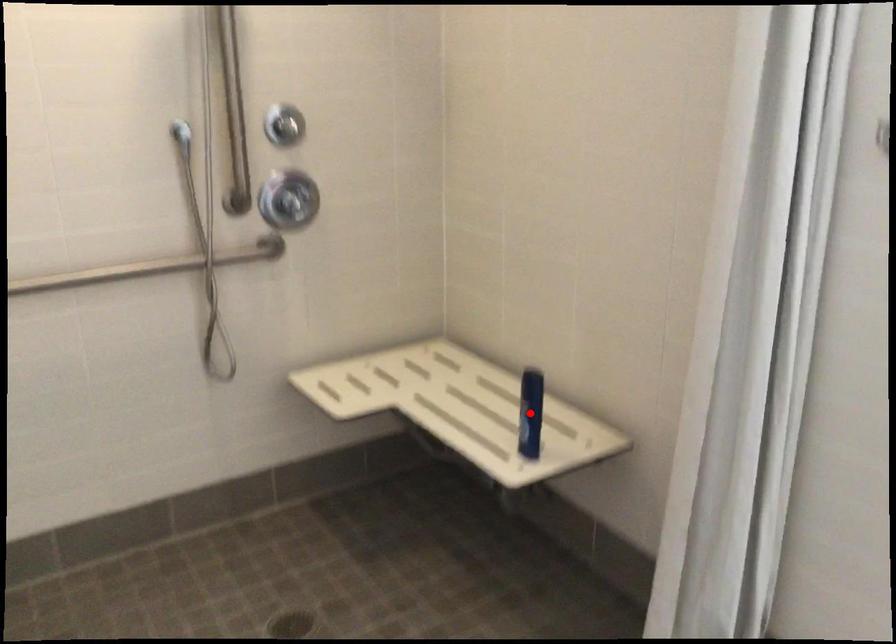
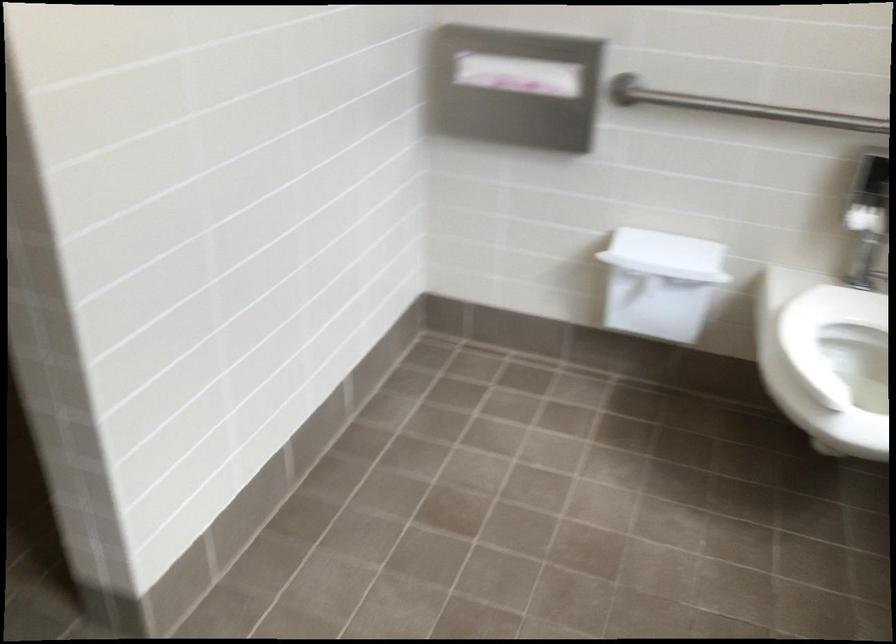
Question: I am providing you with two images of the same scene from different viewpoints. A red point is marked on the first image. Can you still see the location of the red point in image 2?

Choices:
 (A) Yes
 (B) No

Answer: (B)